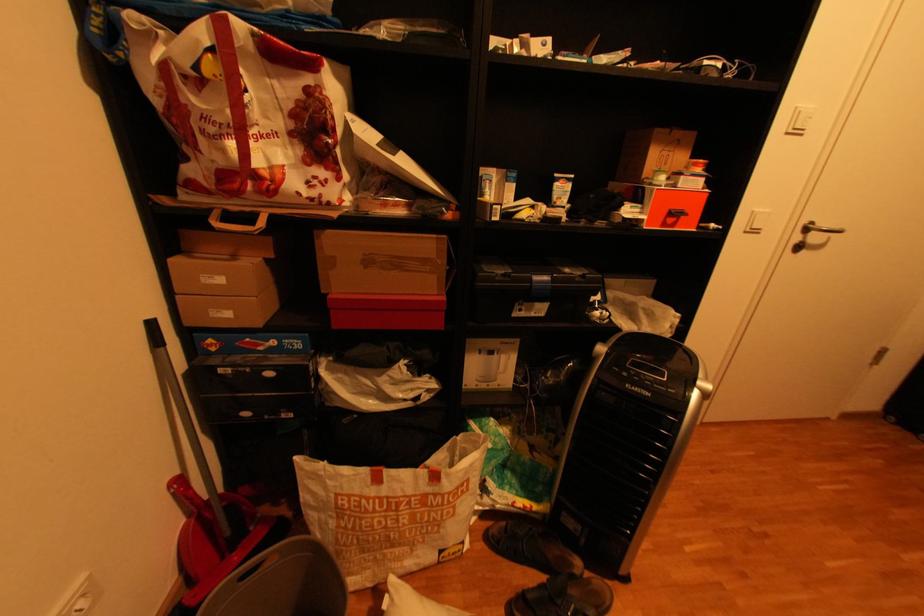
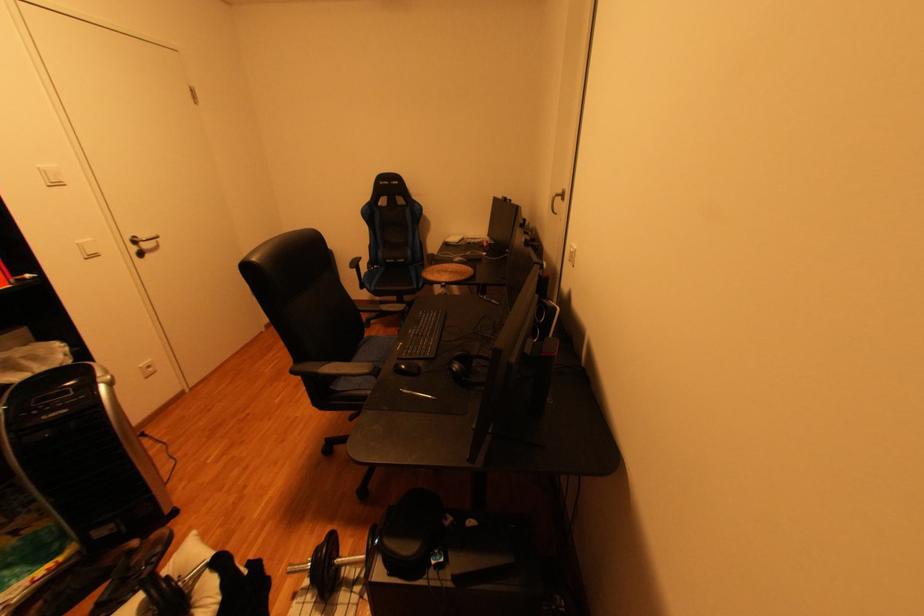
Where in the second image is the point corresponding to pixel 766 209 from the first image?

(89, 243)